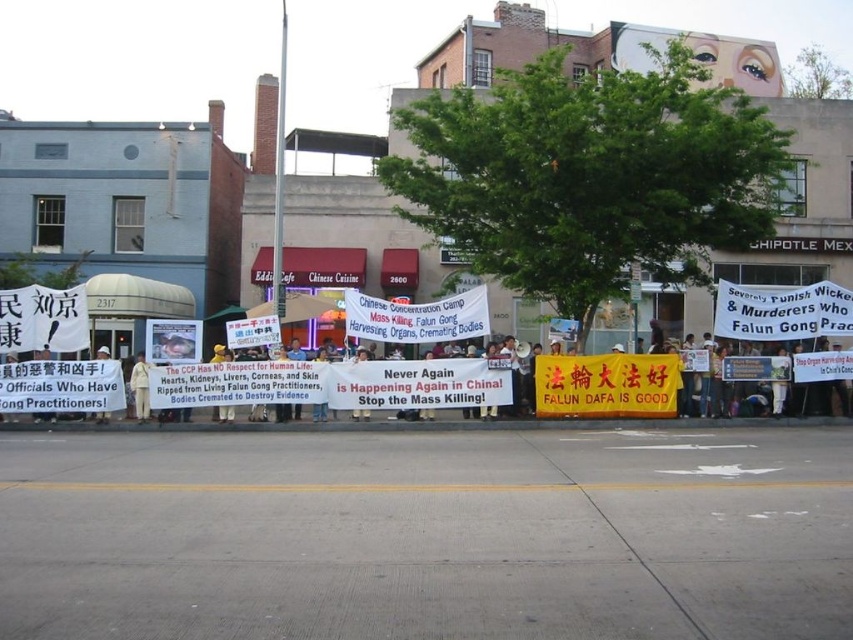
The width and height of the screenshot is (853, 640). Describe the element at coordinates (140, 387) in the screenshot. I see `light beige cotton shirt at center` at that location.

Which is behind, point (146, 381) or point (105, 416)?

Point (105, 416)

The height and width of the screenshot is (640, 853). I want to click on light beige cotton shirt at center, so click(140, 387).